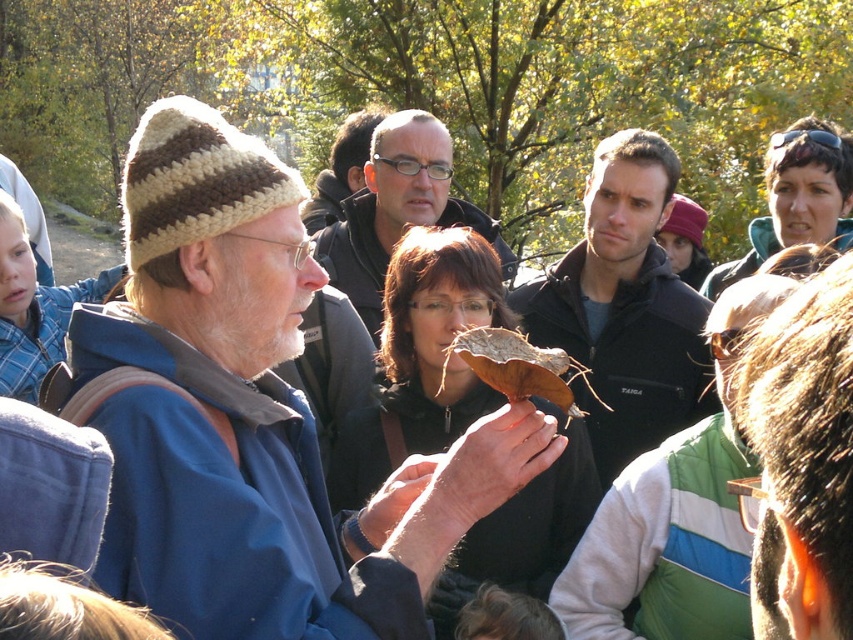
You are a photographer trying to capture a portrait of both the dark brown leather jacket at center and the matte black jacket at center. Since you want them to appear side by side in your photo, which jacket should you position to the left to ensure they are both visible in the frame?

The dark brown leather jacket at center is positioned on the right side of matte black jacket at center, so to have them side by side in the photo, you should position the matte black jacket at center to the left of the dark brown leather jacket at center.

You are standing in the park and want to find the dark brown leather jacket at center. Based on the coordinates provided, where should you look relative to the center of the image?

The dark brown leather jacket at center is located at coordinates point [624,307], which is very close to the center of the image, slightly to the right and down from the exact center.

You are standing at point A, which is at coordinates point (521, 365). You want to walk towards point B, which is at coordinates point (383, 548). Will you be moving forward or backward relative to the direction you are facing?

Since point (383, 548) is behind point (521, 365), moving from point (521, 365) to point (383, 548) would require moving backward relative to the direction you are facing.